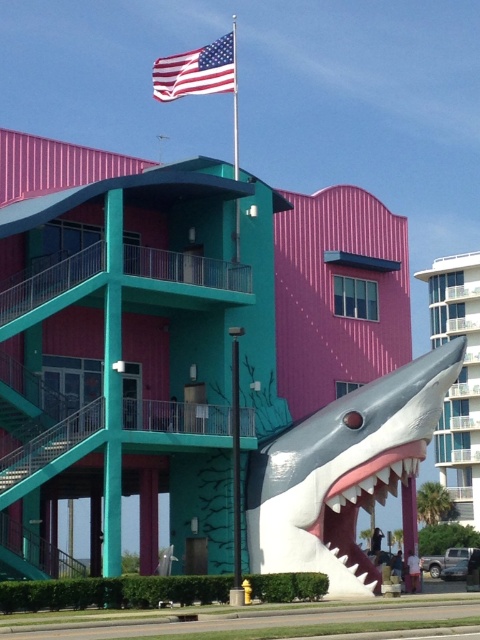
You are standing at the base of the building and want to take a photo of the shiny metallic shark at center with your camera. Given that the camera has a maximum zoom range of 100 feet, will you be able to capture the shark clearly without moving closer?

The shiny metallic shark at center and camera are 217.27 feet apart, which exceeds the camera maximum zoom range of 100 feet. Therefore, you will not be able to capture the shark clearly without moving closer.

You are standing at the entrance of the building and want to take a photo of the smooth white shark at center. Which direction should you face to ensure the shark is in the center of your photo?

You should face towards the smooth white shark at center located at point (457, 378) to have it centered in your photo.

You are standing in front of the colorful building and looking at the two points marked on it. Which point, point (476, 339) or point (313, 531), is closer to you?

Point (313, 531) is closer to you because it is less further to the camera than point (476, 339).